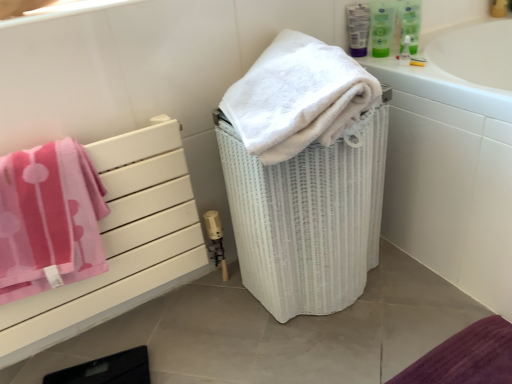
Question: Considering the relative sizes of white wicker laundry basket at center and white fluffy towel at upper right, positioned as the second towel in left-to-right order, in the image provided, is white wicker laundry basket at center shorter than white fluffy towel at upper right, positioned as the second towel in left-to-right order,?

Choices:
 (A) no
 (B) yes

Answer: (A)

Question: From the image's perspective, does white wicker laundry basket at center appear higher than white fluffy towel at upper right, positioned as the second towel in left-to-right order?

Choices:
 (A) no
 (B) yes

Answer: (A)

Question: Does white wicker laundry basket at center have a smaller size compared to white fluffy towel at upper right, which ranks as the first towel in right-to-left order?

Choices:
 (A) yes
 (B) no

Answer: (B)

Question: Is white fluffy towel at upper right, which ranks as the first towel in right-to-left order, completely or partially inside white wicker laundry basket at center?

Choices:
 (A) no
 (B) yes

Answer: (A)

Question: Is the surface of white wicker laundry basket at center in direct contact with white fluffy towel at upper right, positioned as the second towel in left-to-right order?

Choices:
 (A) no
 (B) yes

Answer: (A)

Question: Does white wicker laundry basket at center appear on the right side of white fluffy towel at upper right, positioned as the second towel in left-to-right order?

Choices:
 (A) no
 (B) yes

Answer: (B)

Question: Would you consider white fluffy towel at upper right, positioned as the second towel in left-to-right order, to be distant from pink fabric towel at left?

Choices:
 (A) yes
 (B) no

Answer: (B)

Question: Does white fluffy towel at upper right, which ranks as the first towel in right-to-left order, come behind pink fabric towel at left?

Choices:
 (A) yes
 (B) no

Answer: (B)

Question: Does white fluffy towel at upper right, which ranks as the first towel in right-to-left order, have a smaller size compared to pink fabric towel at left?

Choices:
 (A) no
 (B) yes

Answer: (B)

Question: Can we say white fluffy towel at upper right, which ranks as the first towel in right-to-left order, lies outside pink fabric towel at left?

Choices:
 (A) no
 (B) yes

Answer: (B)

Question: Is white fluffy towel at upper right, which ranks as the first towel in right-to-left order, aimed at pink fabric towel at left?

Choices:
 (A) yes
 (B) no

Answer: (B)

Question: From a real-world perspective, is white fluffy towel at upper right, which ranks as the first towel in right-to-left order, located higher than pink fabric towel at left?

Choices:
 (A) yes
 (B) no

Answer: (A)

Question: Does white glossy bathtub at upper right have a smaller size compared to white wicker laundry basket at center?

Choices:
 (A) yes
 (B) no

Answer: (B)